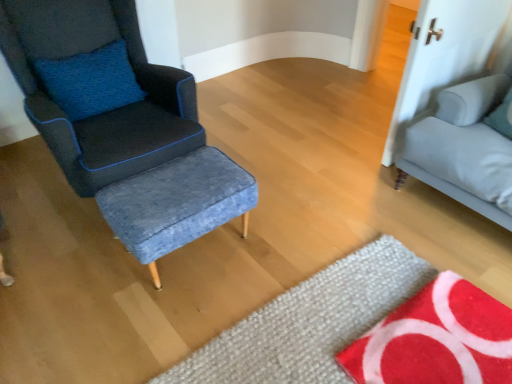
Question: Looking at the image, does red textured mat at lower right, the first mat positioned from the right, seem bigger or smaller compared to textured wool mat at lower center, positioned as the 2th mat in right-to-left order?

Choices:
 (A) small
 (B) big

Answer: (B)

Question: Is red textured mat at lower right, acting as the second mat starting from the left, spatially inside textured wool mat at lower center, positioned as the 2th mat in right-to-left order, or outside of it?

Choices:
 (A) inside
 (B) outside

Answer: (B)

Question: Which object is the farthest from the red textured mat at lower right, acting as the second mat starting from the left?

Choices:
 (A) denim fabric stool at center
 (B) light gray fabric studio couch at right
 (C) textured wool mat at lower center, positioned as the 2th mat in right-to-left order
 (D) matte blue fabric chair at left

Answer: (D)

Question: Considering the real-world distances, which object is farthest from the red textured mat at lower right, the first mat positioned from the right?

Choices:
 (A) textured wool mat at lower center, positioned as the 1th mat in left-to-right order
 (B) matte blue fabric chair at left
 (C) denim fabric stool at center
 (D) light gray fabric studio couch at right

Answer: (B)